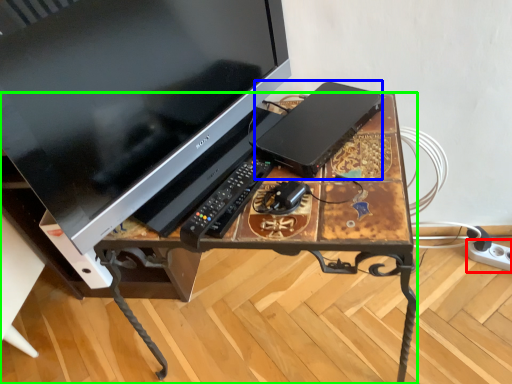
Question: Which is nearer to the extension cord (highlighted by a red box)? computer (highlighted by a blue box) or desk (highlighted by a green box).

Choices:
 (A) computer
 (B) desk

Answer: (A)